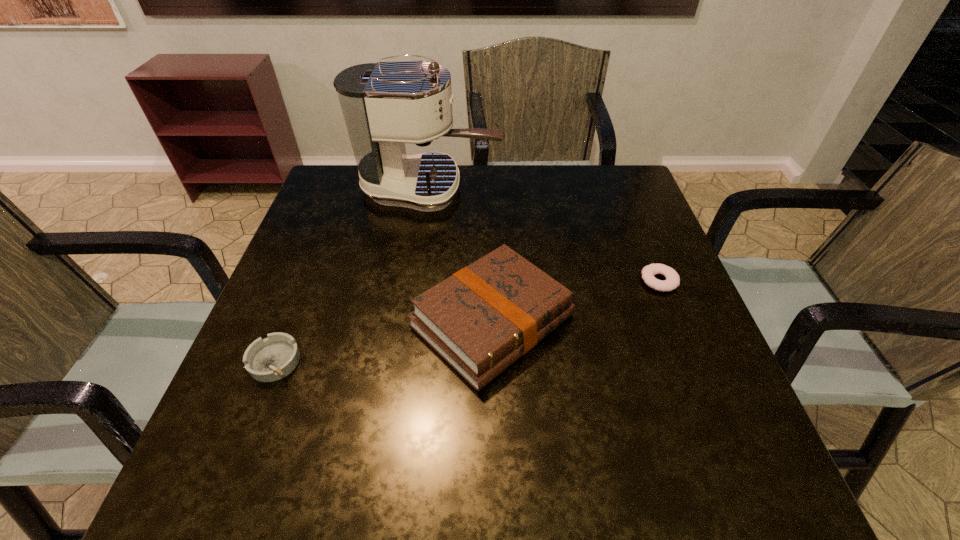
You are a GUI agent. You are given a task and a screenshot of the screen. Output one action in this format:
    pyautogui.click(x=<x>, y=<y>)
    Task: Click on the vacant space located 0.390m on the front of the shortest object
    The image size is (960, 540).
    Given the screenshot: What is the action you would take?
    pyautogui.click(x=741, y=484)

Identify the location of object that is positioned at the far edge. (386, 104).

This screenshot has height=540, width=960. Find the location of `coffee maker located at the left edge`. coffee maker located at the left edge is located at coordinates (386, 104).

Image resolution: width=960 pixels, height=540 pixels. What are the coordinates of `ashtray at the left edge` in the screenshot? It's located at pos(273,358).

You are a GUI agent. You are given a task and a screenshot of the screen. Output one action in this format:
    pyautogui.click(x=<x>, y=<y>)
    Task: Click on the object positioned at the right edge
    
    Given the screenshot: What is the action you would take?
    pyautogui.click(x=672, y=281)

What are the coordinates of `object located in the far left corner section of the desktop` in the screenshot? It's located at (386, 104).

Image resolution: width=960 pixels, height=540 pixels. Find the location of `free space at the far edge of the desktop`. free space at the far edge of the desktop is located at coordinates (510, 216).

Locate an element on the screen. This screenshot has width=960, height=540. free space at the near edge is located at coordinates (382, 471).

Where is `vacant space at the left edge of the desktop`? The image size is (960, 540). vacant space at the left edge of the desktop is located at coordinates (316, 416).

Locate an element on the screen. This screenshot has width=960, height=540. vacant point at the right edge is located at coordinates (653, 342).